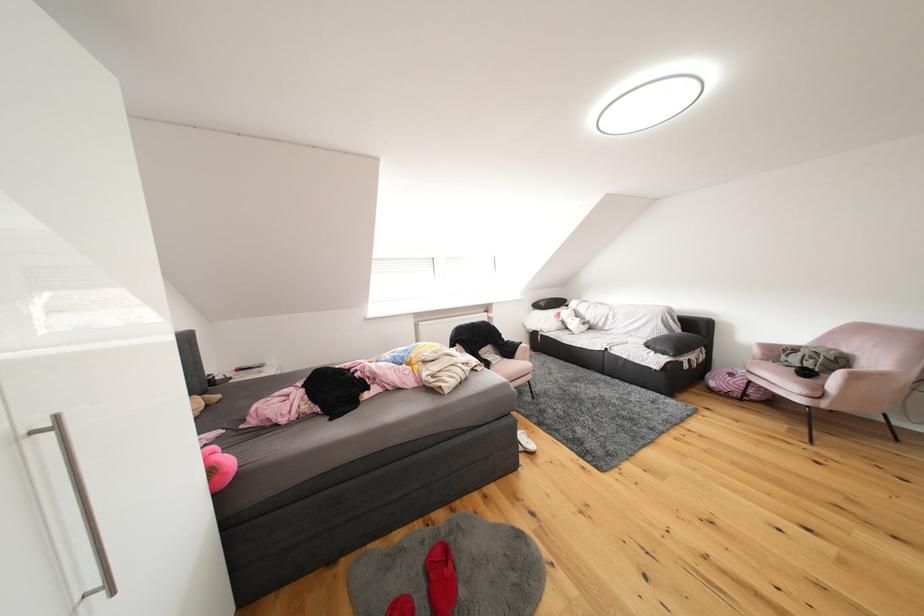
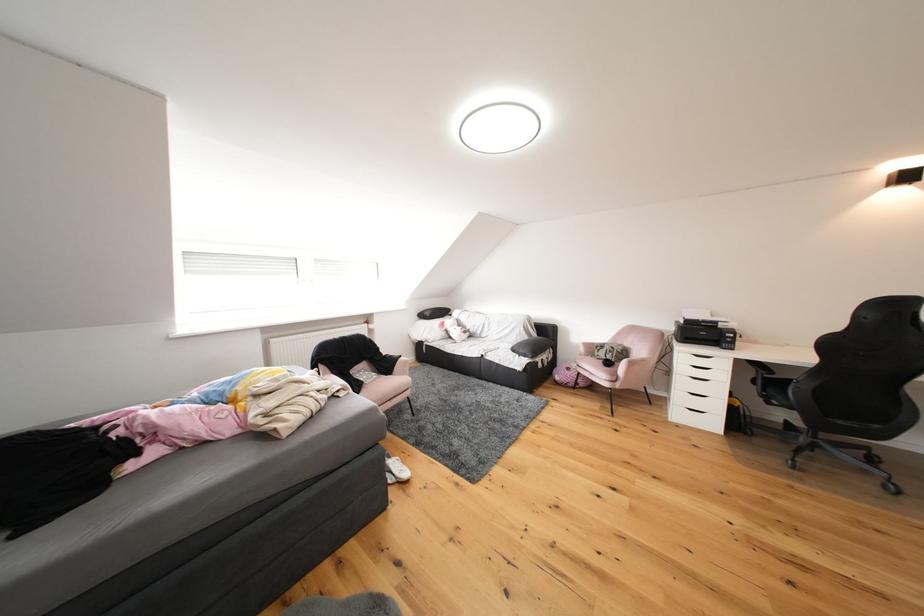
Which direction would the cameraman need to move to produce the second image?

The cameraman walked toward right, forward.